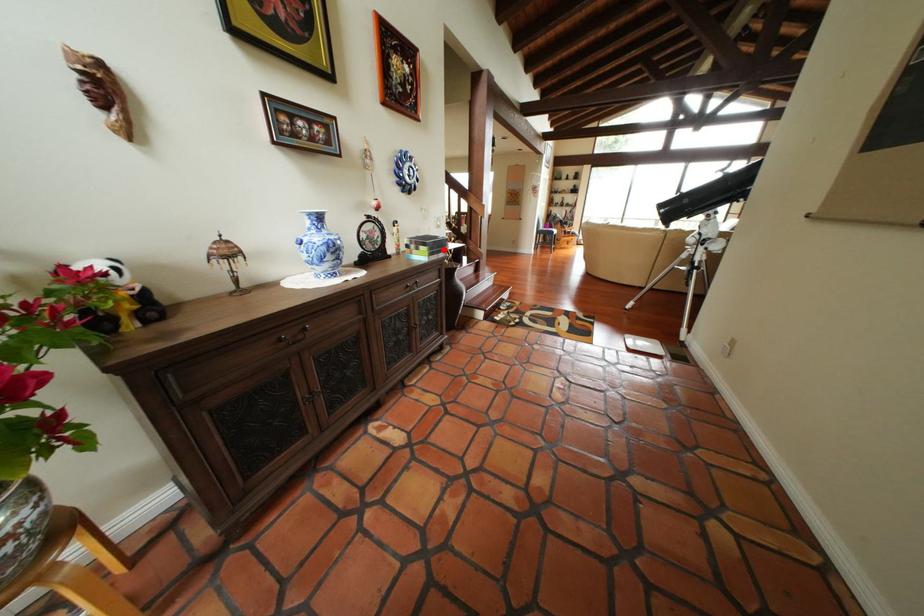
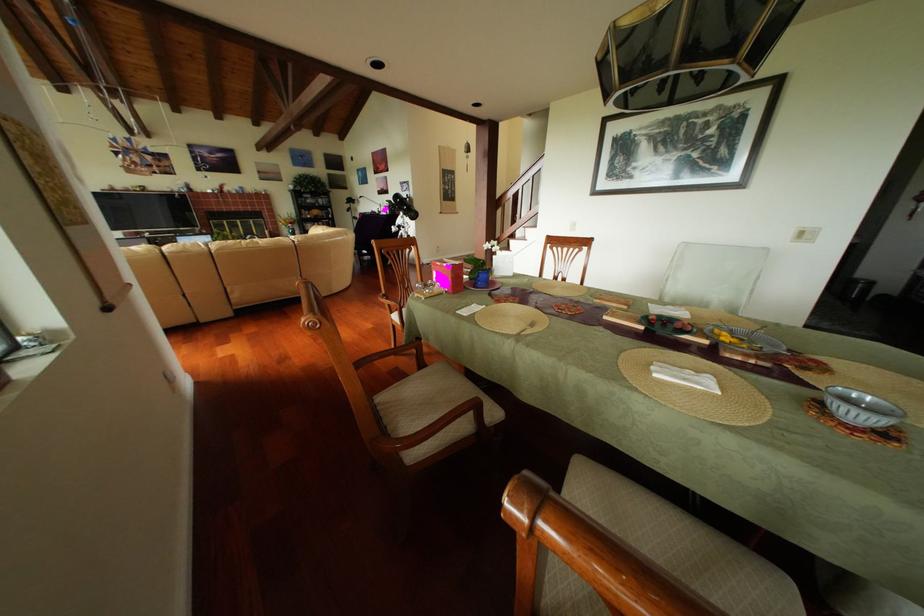
Question: I am providing you with two images of the same scene from different viewpoints. A red point is marked on the first image. Is the red point's position out of view in image 2?

Choices:
 (A) Yes
 (B) No

Answer: (A)